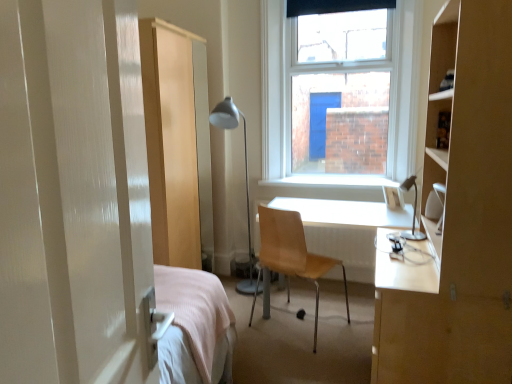
Where is `vacant space in front of wooden chair at center`? The width and height of the screenshot is (512, 384). vacant space in front of wooden chair at center is located at coordinates (307, 361).